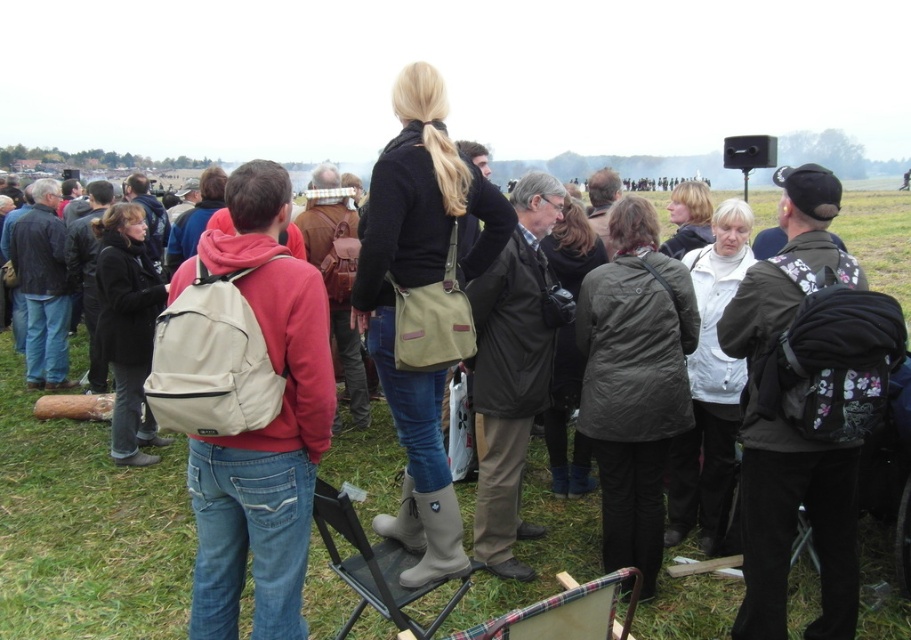
You are planning to place a dark green backpack at right on the green grass at center. Is there enough space for the backpack?

The green grass at center might be wider than the dark green backpack at right, so there is likely enough space to place the backpack there.

You are standing in the middle of the grassy field and see the green grass at center and the beige fabric backpack at center. Which object is positioned to the left side?

The green grass at center is positioned to the left of the beige fabric backpack at center.